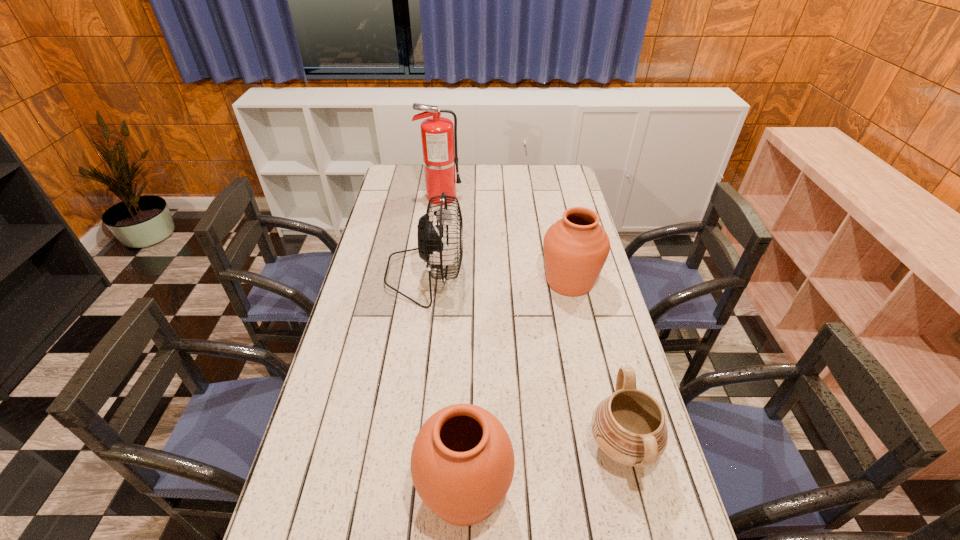
Image resolution: width=960 pixels, height=540 pixels. Find the location of `vacant space located 0.120m on the front-facing side of the shortest urn`. vacant space located 0.120m on the front-facing side of the shortest urn is located at coordinates (540, 446).

Where is `object that is at the far edge`? object that is at the far edge is located at coordinates (438, 134).

Locate an element on the screen. The image size is (960, 540). object positioned at the left edge is located at coordinates (431, 238).

The height and width of the screenshot is (540, 960). In the image, there is a desktop. Find the location of `blank space at the far edge`. blank space at the far edge is located at coordinates (477, 178).

I want to click on free space at the left edge of the desktop, so click(368, 333).

At what (x,y) coordinates should I click in order to perform the action: click on vacant space at the right edge of the desktop. Please return your answer as a coordinate pair (x, y). Image resolution: width=960 pixels, height=540 pixels. Looking at the image, I should click on (607, 345).

Find the location of a particular element. Image resolution: width=960 pixels, height=540 pixels. vacant region at the far left corner of the desktop is located at coordinates click(x=401, y=165).

This screenshot has width=960, height=540. I want to click on free region at the far right corner, so click(x=542, y=170).

Where is `free space between the fan and the shortest urn`? The image size is (960, 540). free space between the fan and the shortest urn is located at coordinates (523, 360).

Where is `vacant space in between the farthest urn and the fan`? This screenshot has height=540, width=960. vacant space in between the farthest urn and the fan is located at coordinates (497, 278).